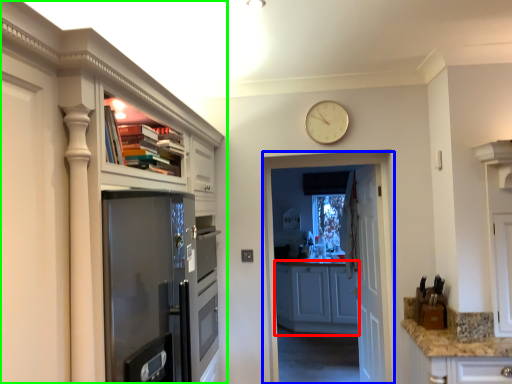
Question: Which object is positioned closest to cabinetry (highlighted by a red box)? Select from screen door (highlighted by a blue box) and cabinetry (highlighted by a green box).

Choices:
 (A) screen door
 (B) cabinetry

Answer: (A)